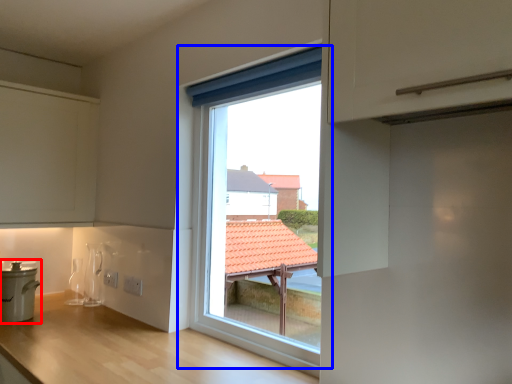
Question: Which of the following is the closest to the observer, cooker (highlighted by a red box) or window (highlighted by a blue box)?

Choices:
 (A) cooker
 (B) window

Answer: (B)